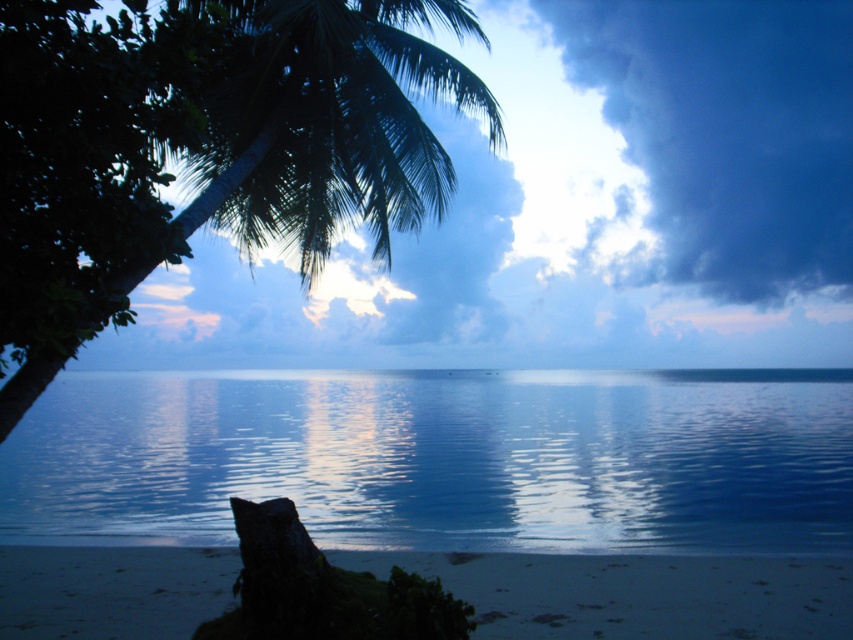
Question: Among these points, which one is farthest from the camera?

Choices:
 (A) (517, 440)
 (B) (189, 608)
 (C) (294, 102)

Answer: (A)

Question: Is smooth blue water at center thinner than green leafy palm at upper left?

Choices:
 (A) yes
 (B) no

Answer: (B)

Question: Is green leafy palm at upper left to the left of sandy beach at lower center from the viewer's perspective?

Choices:
 (A) no
 (B) yes

Answer: (B)

Question: Which is farther from the smooth blue water at center?

Choices:
 (A) green leafy palm at upper left
 (B) sandy beach at lower center

Answer: (A)

Question: Which object is closer to the camera taking this photo?

Choices:
 (A) green leafy palm at upper left
 (B) smooth blue water at center
 (C) sandy beach at lower center

Answer: (A)

Question: Is smooth blue water at center thinner than sandy beach at lower center?

Choices:
 (A) yes
 (B) no

Answer: (B)